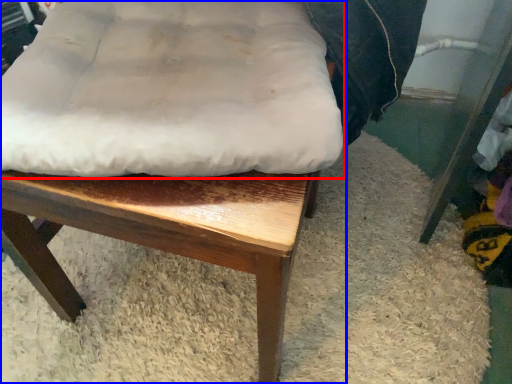
Question: Which point is further to the camera, sheet (highlighted by a red box) or chair (highlighted by a blue box)?

Choices:
 (A) sheet
 (B) chair

Answer: (A)